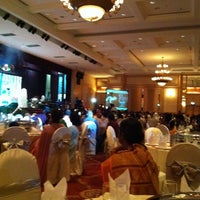
You are a GUI agent. You are given a task and a screenshot of the screen. Output one action in this format:
    pyautogui.click(x=<x>, y=<y>)
    Task: Click on the brown floor
    This screenshot has height=200, width=200.
    Given the screenshot: What is the action you would take?
    pyautogui.click(x=89, y=179)